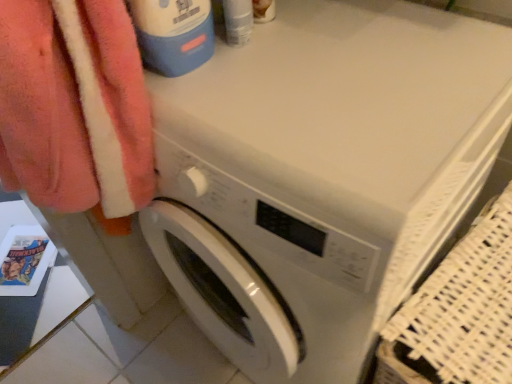
You are a GUI agent. You are given a task and a screenshot of the screen. Output one action in this format:
    pyautogui.click(x=<x>, y=<y>)
    Task: Click on the white glossy washing machine at center
    
    Given the screenshot: What is the action you would take?
    pyautogui.click(x=325, y=176)

Describe the element at coordinates (325, 176) in the screenshot. The width and height of the screenshot is (512, 384). I see `white glossy washing machine at center` at that location.

Where is `blue plastic bottle at upper left`? blue plastic bottle at upper left is located at coordinates (173, 34).

The image size is (512, 384). What do you see at coordinates (173, 34) in the screenshot?
I see `blue plastic bottle at upper left` at bounding box center [173, 34].

What is the approximate height of blue plastic bottle at upper left?

blue plastic bottle at upper left is 11.75 inches tall.

Where is `white glossy washing machine at center`? The width and height of the screenshot is (512, 384). white glossy washing machine at center is located at coordinates pos(325,176).

Considering the positions of objects blue plastic bottle at upper left and white glossy washing machine at center in the image provided, who is more to the left, blue plastic bottle at upper left or white glossy washing machine at center?

From the viewer's perspective, blue plastic bottle at upper left appears more on the left side.

In the image, is blue plastic bottle at upper left positioned in front of or behind white glossy washing machine at center?

blue plastic bottle at upper left is positioned farther from the viewer than white glossy washing machine at center.

Does point (169, 36) come behind point (500, 30)?

No, it is in front of (500, 30).

From the image's perspective, is blue plastic bottle at upper left positioned above or below white glossy washing machine at center?

Based on their image positions, blue plastic bottle at upper left is located above white glossy washing machine at center.

From a real-world perspective, is blue plastic bottle at upper left positioned above or below white glossy washing machine at center?

In terms of real-world spatial position, blue plastic bottle at upper left is above white glossy washing machine at center.

Which object is wider, blue plastic bottle at upper left or white glossy washing machine at center?

white glossy washing machine at center is wider.

Considering the relative sizes of blue plastic bottle at upper left and white glossy washing machine at center in the image provided, is blue plastic bottle at upper left shorter than white glossy washing machine at center?

Correct, blue plastic bottle at upper left is not as tall as white glossy washing machine at center.

Which of these two, blue plastic bottle at upper left or white glossy washing machine at center, is bigger?

white glossy washing machine at center.

Is blue plastic bottle at upper left positioned beyond the bounds of white glossy washing machine at center?

blue plastic bottle at upper left is positioned outside white glossy washing machine at center.

Is blue plastic bottle at upper left far away from white glossy washing machine at center?

blue plastic bottle at upper left is actually quite close to white glossy washing machine at center.

Could you tell me if blue plastic bottle at upper left is turned towards white glossy washing machine at center?

No, blue plastic bottle at upper left does not turn towards white glossy washing machine at center.

How distant is blue plastic bottle at upper left from white glossy washing machine at center?

A distance of 32.01 centimeters exists between blue plastic bottle at upper left and white glossy washing machine at center.

Locate an element on the screen. The image size is (512, 384). cleaning product on the left side of white glossy washing machine at center is located at coordinates (173, 34).

Which object is positioned more to the right, white glossy washing machine at center or blue plastic bottle at upper left?

Positioned to the right is white glossy washing machine at center.

Between white glossy washing machine at center and blue plastic bottle at upper left, which one is positioned behind?

blue plastic bottle at upper left is further from the camera.

Which is in front, point (376, 214) or point (157, 36)?

The point (376, 214) is in front.

From the image's perspective, who appears lower, white glossy washing machine at center or blue plastic bottle at upper left?

white glossy washing machine at center appears lower in the image.

From a real-world perspective, is white glossy washing machine at center positioned above or below blue plastic bottle at upper left?

white glossy washing machine at center is below blue plastic bottle at upper left.

Based on the photo, considering the relative sizes of white glossy washing machine at center and blue plastic bottle at upper left in the image provided, is white glossy washing machine at center thinner than blue plastic bottle at upper left?

In fact, white glossy washing machine at center might be wider than blue plastic bottle at upper left.

From the picture: Can you confirm if white glossy washing machine at center is taller than blue plastic bottle at upper left?

Yes.

Can you confirm if white glossy washing machine at center is bigger than blue plastic bottle at upper left?

Yes, white glossy washing machine at center is bigger than blue plastic bottle at upper left.

Would you say blue plastic bottle at upper left is part of white glossy washing machine at center's contents?

Definitely not — blue plastic bottle at upper left is not inside white glossy washing machine at center.

Would you consider white glossy washing machine at center to be distant from blue plastic bottle at upper left?

They are positioned close to each other.

Is white glossy washing machine at center oriented away from blue plastic bottle at upper left?

white glossy washing machine at center does not have its back to blue plastic bottle at upper left.

How many degrees apart are the facing directions of white glossy washing machine at center and blue plastic bottle at upper left?

85.4 degrees.

I want to click on washing machine below the blue plastic bottle at upper left (from the image's perspective), so click(325, 176).

Locate an element on the screen. The width and height of the screenshot is (512, 384). washing machine lying on the right of blue plastic bottle at upper left is located at coordinates (325, 176).

Find the location of a particular element. Image resolution: width=512 pixels, height=384 pixels. cleaning product above the white glossy washing machine at center (from a real-world perspective) is located at coordinates (173, 34).